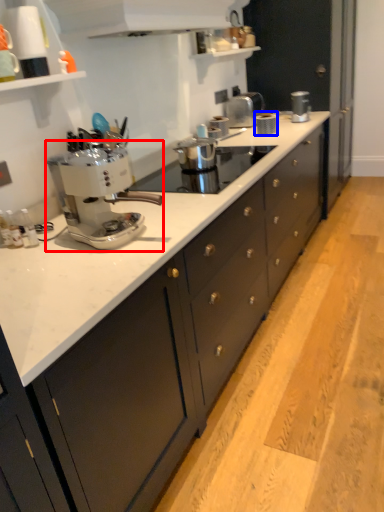
Question: Which point is closer to the camera, coffee maker (highlighted by a red box) or kitchen appliance (highlighted by a blue box)?

Choices:
 (A) coffee maker
 (B) kitchen appliance

Answer: (A)